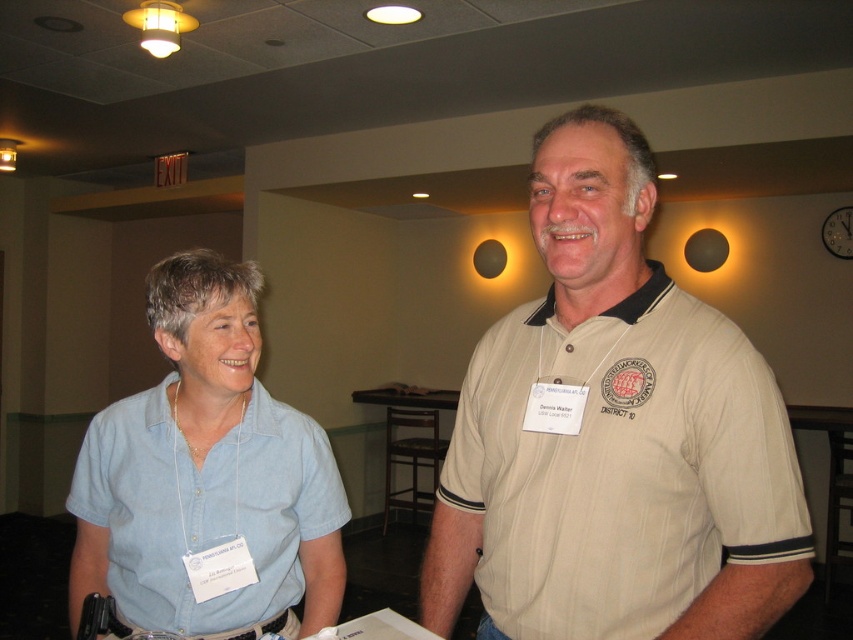
Based on the photo, you are standing in the room and want to locate the beige striped polo shirt at center. According to the coordinates given, where exactly is it positioned?

The beige striped polo shirt at center is positioned at the 2D coordinates point (614, 436).

Based on the scene description, which of the two shirts, the beige striped polo shirt at center or the light blue shirt at left, has a larger size?

The beige striped polo shirt at center is larger in size than the light blue shirt at left according to the description.

Looking at this image, you are standing in the conference room and want to approach the person wearing the beige striped polo shirt at center and the light blue shirt at left. Which one should you walk towards first to reach the closer one?

You should walk towards the beige striped polo shirt at center first because it is closer to you than the light blue shirt at left.